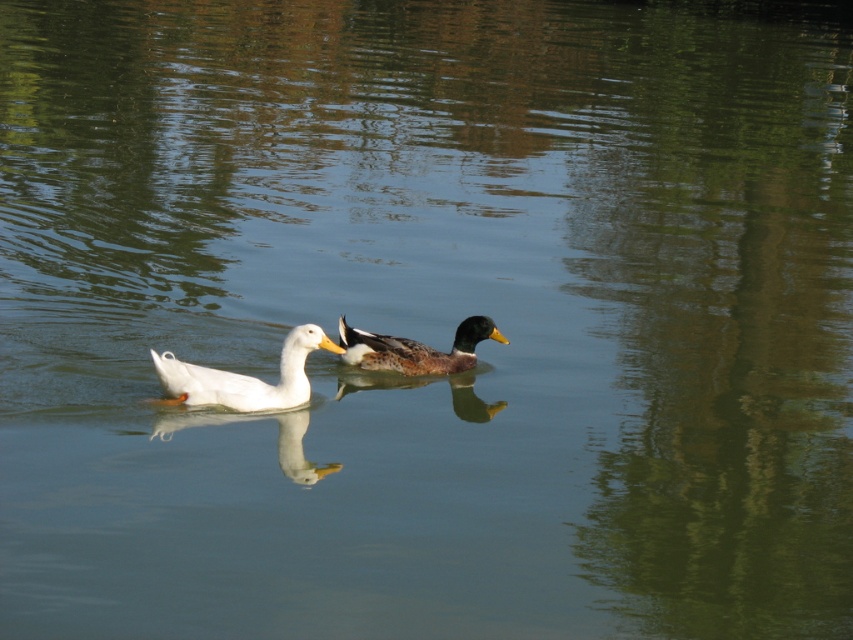
Does point (190, 390) come in front of point (343, 356)?

Yes, point (190, 390) is closer to viewer.

Can you confirm if white matte duck at center is positioned to the right of shiny brown duck at center?

In fact, white matte duck at center is to the left of shiny brown duck at center.

Identify the location of white matte duck at center. (242, 378).

At what (x,y) coordinates should I click in order to perform the action: click on white matte duck at center. Please return your answer as a coordinate pair (x, y). The height and width of the screenshot is (640, 853). Looking at the image, I should click on (242, 378).